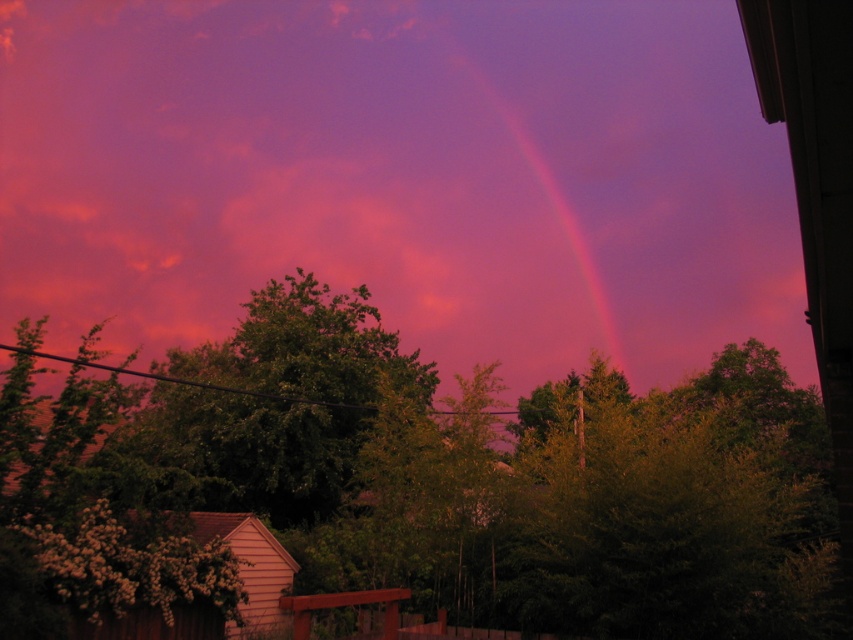
Question: Among these objects, which one is nearest to the camera?

Choices:
 (A) pink translucent cloud at upper center
 (B) rainbow at upper center

Answer: (A)

Question: Is pink translucent cloud at upper center smaller than rainbow at upper center?

Choices:
 (A) yes
 (B) no

Answer: (B)

Question: Which point appears closest to the camera in this image?

Choices:
 (A) (532, 161)
 (B) (373, 16)

Answer: (A)

Question: Considering the relative positions of pink translucent cloud at upper center and rainbow at upper center in the image provided, where is pink translucent cloud at upper center located with respect to rainbow at upper center?

Choices:
 (A) above
 (B) below

Answer: (B)

Question: Is pink translucent cloud at upper center below rainbow at upper center?

Choices:
 (A) yes
 (B) no

Answer: (A)